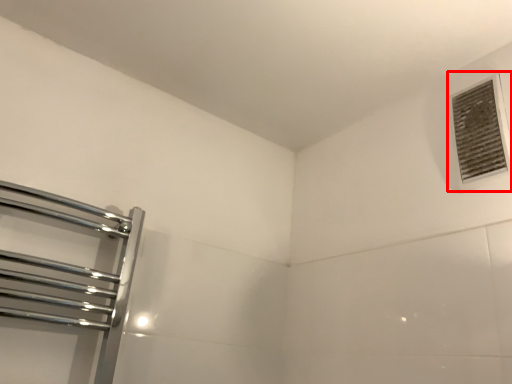
Question: Considering the relative positions of air conditioning (annotated by the red box) and towel rack in the image provided, where is air conditioning (annotated by the red box) located with respect to the staircase?

Choices:
 (A) left
 (B) right

Answer: (B)